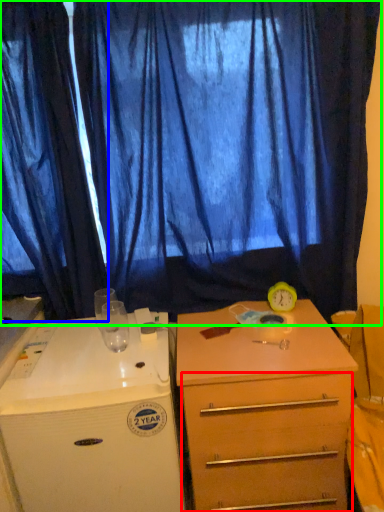
Question: Which is farther away from drawer (highlighted by a red box)? curtain (highlighted by a blue box) or curtain (highlighted by a green box)?

Choices:
 (A) curtain
 (B) curtain

Answer: (A)